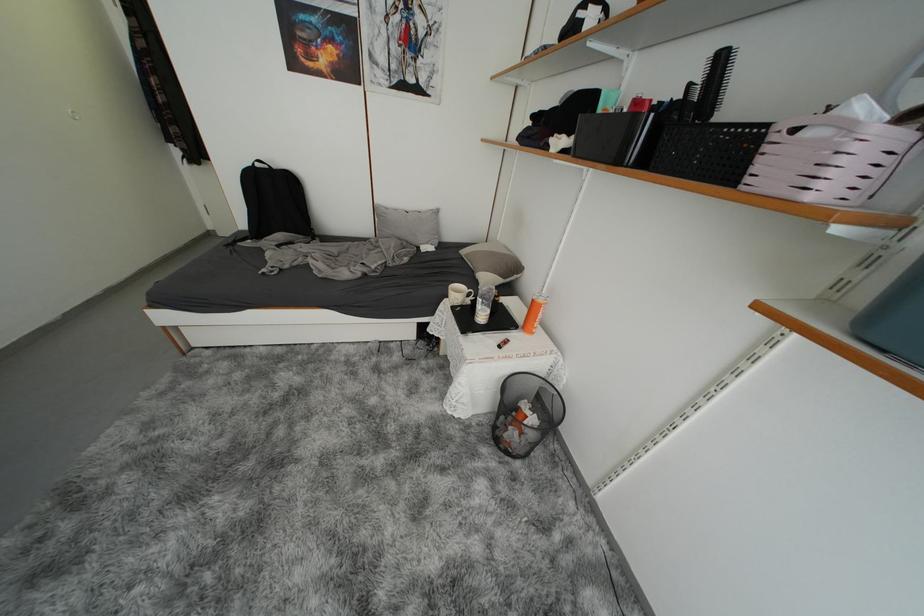
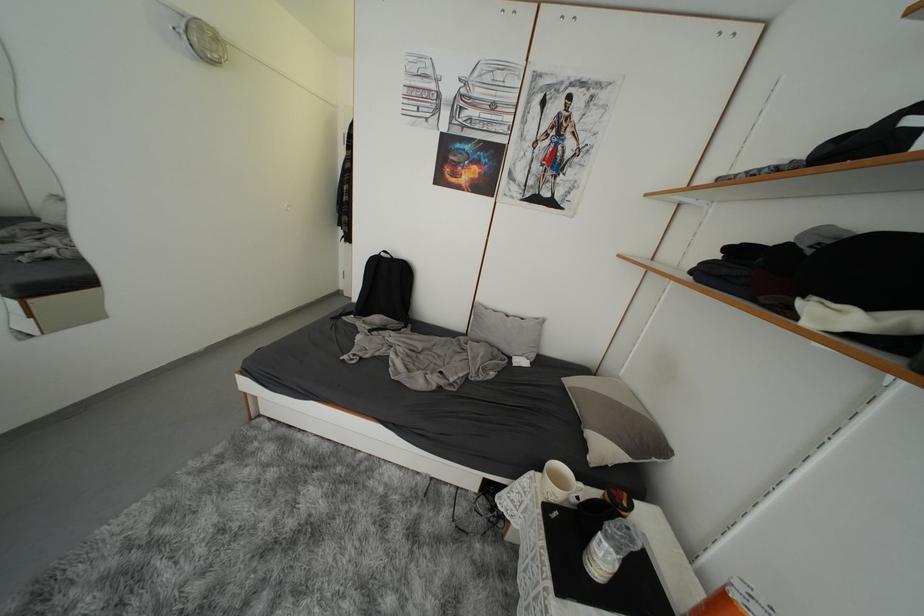
Find the pixel in the second image that matches the point at 487,304 in the first image.

(612, 549)